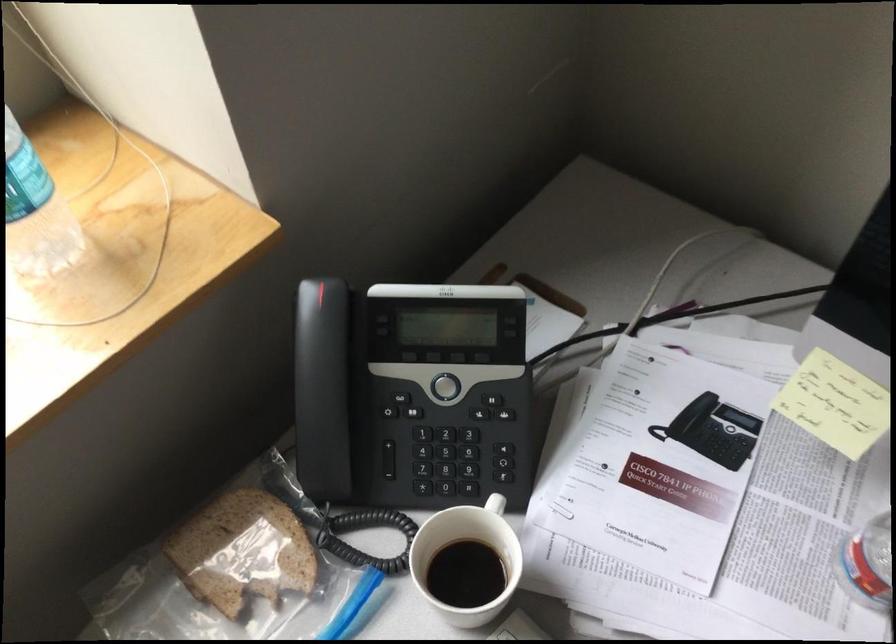
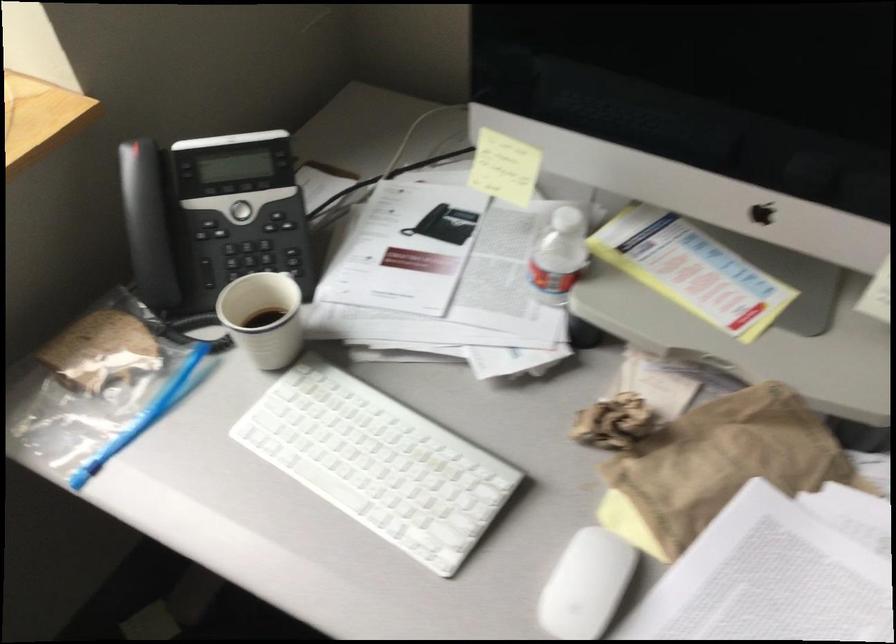
Find the pixel in the second image that matches point (460, 544) in the first image.

(263, 317)